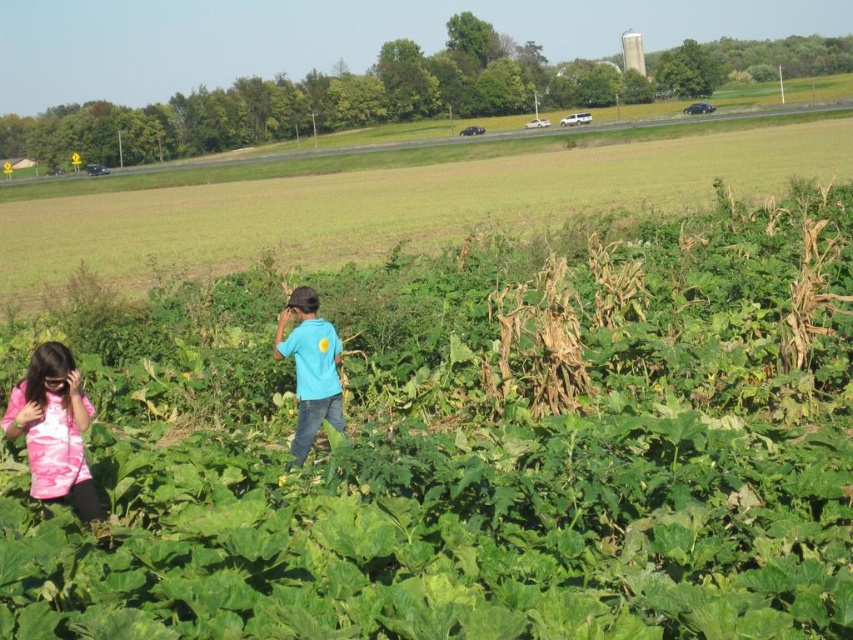
Measure the distance between pink tie-dye shirt at lower left and matte blue shirt at center.

They are 7.71 feet apart.

Who is taller, pink tie-dye shirt at lower left or matte blue shirt at center?

matte blue shirt at center

Does point (71, 392) come behind point (306, 353)?

No, (71, 392) is closer to viewer.

This screenshot has height=640, width=853. In order to click on pink tie-dye shirt at lower left in this screenshot , I will do `click(53, 429)`.

Does point (666, 504) come closer to viewer compared to point (7, 429)?

Yes, point (666, 504) is in front of point (7, 429).

Which of these two, green leafy plant at center or pink tie-dye shirt at lower left, stands taller?

Standing taller between the two is green leafy plant at center.

What do you see at coordinates (469, 449) in the screenshot? I see `green leafy plant at center` at bounding box center [469, 449].

The width and height of the screenshot is (853, 640). I want to click on green leafy plant at center, so click(x=469, y=449).

Can you confirm if green leafy plant at center is positioned to the left of matte blue shirt at center?

In fact, green leafy plant at center is to the right of matte blue shirt at center.

Is point (422, 460) farther from viewer compared to point (308, 397)?

No, it is in front of (308, 397).

You are a GUI agent. You are given a task and a screenshot of the screen. Output one action in this format:
    pyautogui.click(x=<x>, y=<y>)
    Task: Click on the green leafy plant at center
    This screenshot has width=853, height=640.
    Given the screenshot: What is the action you would take?
    pyautogui.click(x=469, y=449)